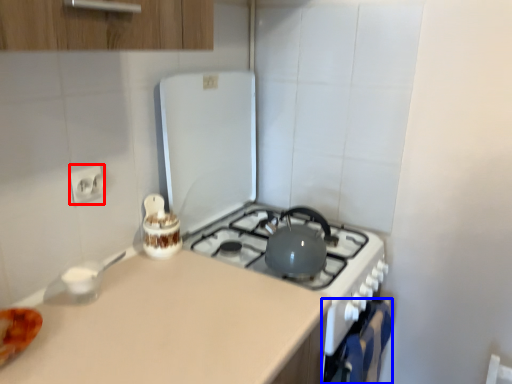
Question: Which of the following is the closest to the observer, electric outlet (highlighted by a red box) or oven (highlighted by a blue box)?

Choices:
 (A) electric outlet
 (B) oven

Answer: (A)